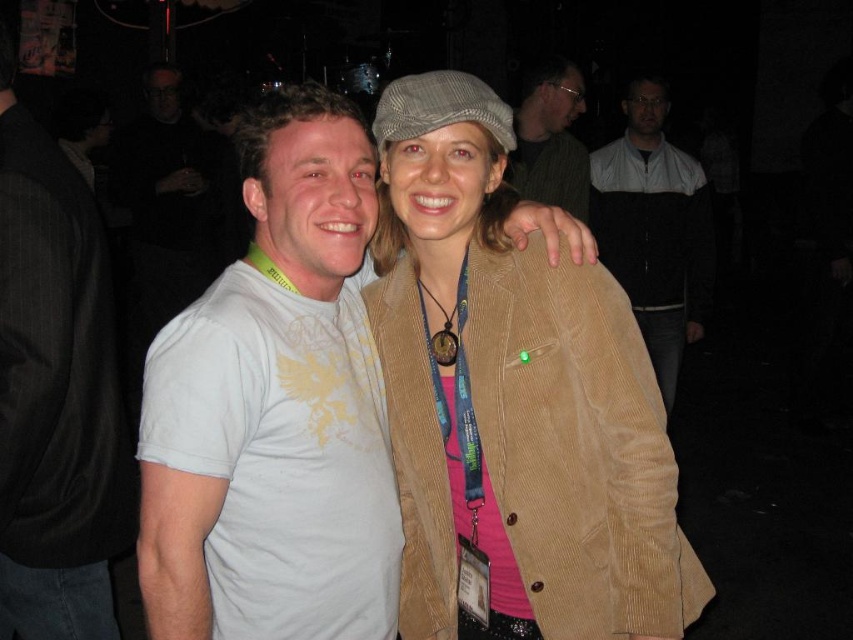
What are the coordinates of the corduroy blazer at center?

The corduroy blazer at center is located at coordinates point (x=514, y=400).